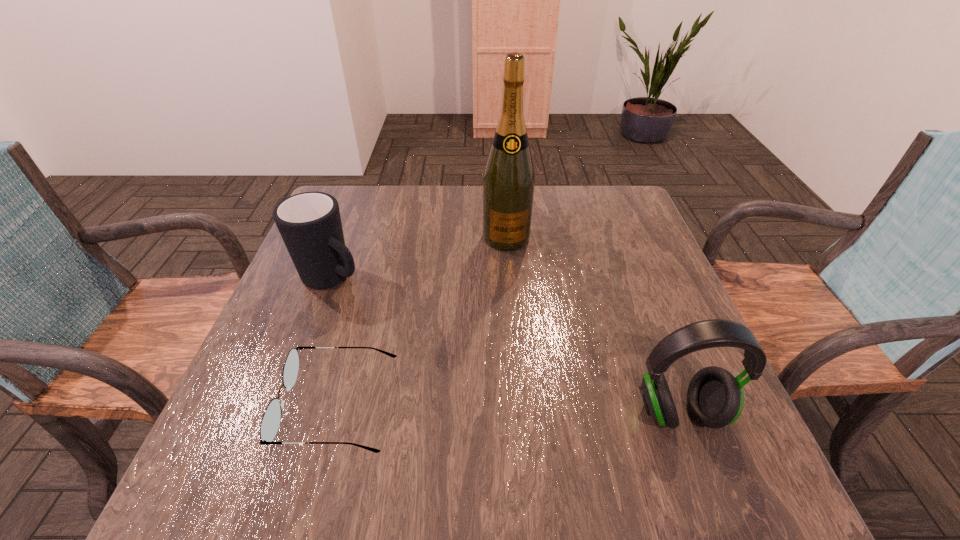
Where is `vacant point located between the third object from left to right and the spectacles`? vacant point located between the third object from left to right and the spectacles is located at coordinates (422, 321).

This screenshot has width=960, height=540. Identify the location of free spot between the wine bottle and the mug. (420, 258).

You are a GUI agent. You are given a task and a screenshot of the screen. Output one action in this format:
    pyautogui.click(x=<x>, y=<y>)
    Task: Click on the unoccupied area between the spectacles and the farthest object
    The height and width of the screenshot is (540, 960).
    Given the screenshot: What is the action you would take?
    pyautogui.click(x=422, y=321)

At what (x,y) coordinates should I click in order to perform the action: click on empty space that is in between the rightmost object and the third object from left to right. Please return your answer as a coordinate pair (x, y). Looking at the image, I should click on (592, 325).

Find the location of a particular element. This screenshot has height=540, width=960. free space between the second farthest object and the third object from left to right is located at coordinates (420, 258).

I want to click on free spot between the spectacles and the headset, so click(x=509, y=409).

The height and width of the screenshot is (540, 960). I want to click on object that is the second closest to the second object from right to left, so click(x=270, y=422).

Identify which object is the nearest to the third nearest object. Please provide its 2D coordinates. Your answer should be formatted as a tuple, i.e. [(x, y)], where the tuple contains the x and y coordinates of a point satisfying the conditions above.

[(270, 422)]